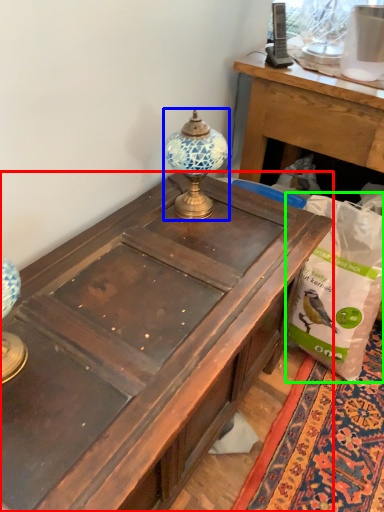
Question: Which object is the closest to the desk (highlighted by a red box)? Choose among these: lamp (highlighted by a blue box) or paper bag (highlighted by a green box).

Choices:
 (A) lamp
 (B) paper bag

Answer: (A)